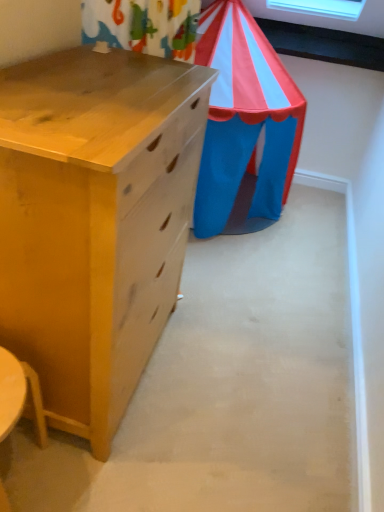
This screenshot has height=512, width=384. What do you see at coordinates (19, 395) in the screenshot?
I see `wooden desk at lower left` at bounding box center [19, 395].

Locate an element on the screen. The image size is (384, 512). wooden desk at lower left is located at coordinates (19, 395).

In order to face wooden desk at lower left, should I rotate leftwards or rightwards?

It's best to rotate left around 24.751 degrees.

Find the location of `wooden desk at lower left`. wooden desk at lower left is located at coordinates tap(19, 395).